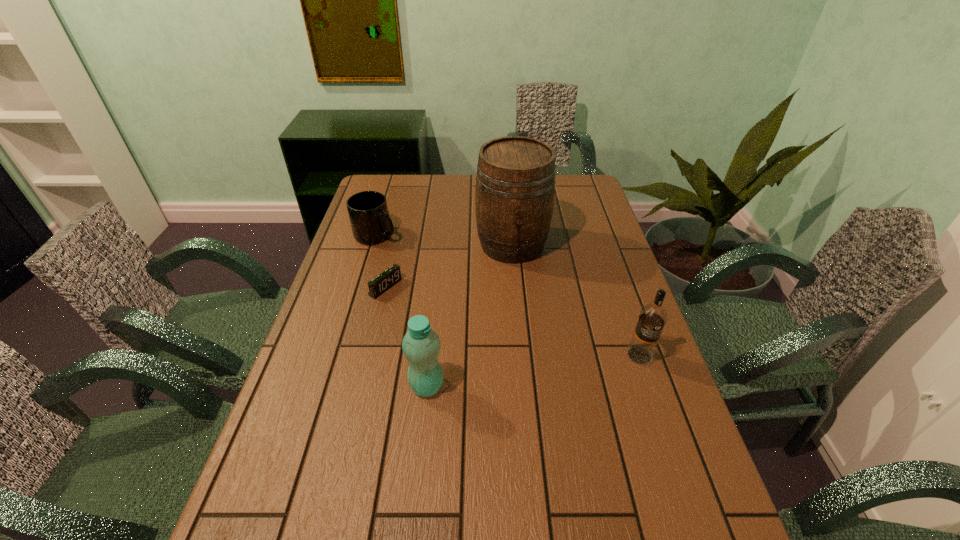
In order to click on the nearest object in this screenshot , I will do [421, 345].

You are a GUI agent. You are given a task and a screenshot of the screen. Output one action in this format:
    pyautogui.click(x=<x>, y=<y>)
    Task: Click on the third object from left to right
    The image size is (960, 540).
    Given the screenshot: What is the action you would take?
    pyautogui.click(x=421, y=345)

The image size is (960, 540). In order to click on vodka in this screenshot , I will do `click(653, 316)`.

Locate an element on the screen. the second nearest object is located at coordinates (653, 316).

The width and height of the screenshot is (960, 540). I want to click on the fourth object from left to right, so click(515, 182).

At what (x,y) coordinates should I click in order to perform the action: click on cider. Please return your answer as a coordinate pair (x, y). Looking at the image, I should click on (515, 182).

Locate an element on the screen. Image resolution: width=960 pixels, height=540 pixels. mug is located at coordinates (369, 217).

Identify the location of the third nearest object. The width and height of the screenshot is (960, 540). (384, 281).

Where is `alarm clock`? This screenshot has height=540, width=960. alarm clock is located at coordinates (384, 281).

Where is `vacant space located 0.360m on the back of the nearest object`? This screenshot has width=960, height=540. vacant space located 0.360m on the back of the nearest object is located at coordinates (439, 278).